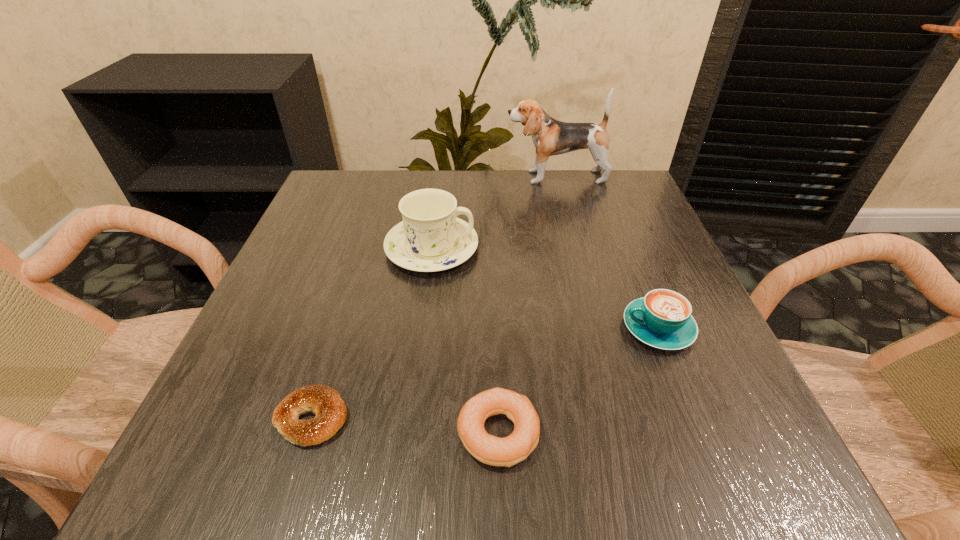
I want to click on the farthest object, so click(x=550, y=137).

At what (x,y) coordinates should I click in order to perform the action: click on the tallest object. Please return your answer as a coordinate pair (x, y). The width and height of the screenshot is (960, 540). Looking at the image, I should click on (550, 137).

Where is `the second farthest object`? This screenshot has height=540, width=960. the second farthest object is located at coordinates (431, 238).

In order to click on chinaware in this screenshot , I will do `click(431, 238)`.

Identify the location of cappuccino. (662, 319).

At what (x,y) coordinates should I click in order to perform the action: click on the third farthest object. Please return your answer as a coordinate pair (x, y). Looking at the image, I should click on (662, 319).

Find the location of a particular element. the taller bagel is located at coordinates (508, 451).

Find the location of a particular element. the right bagel is located at coordinates (508, 451).

I want to click on the shorter bagel, so click(322, 400).

I want to click on the left bagel, so click(x=322, y=400).